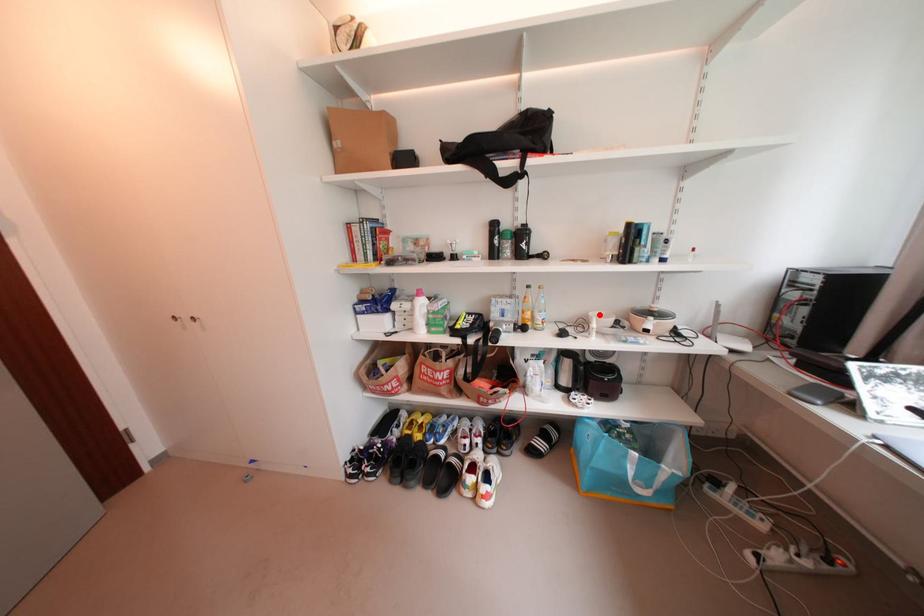
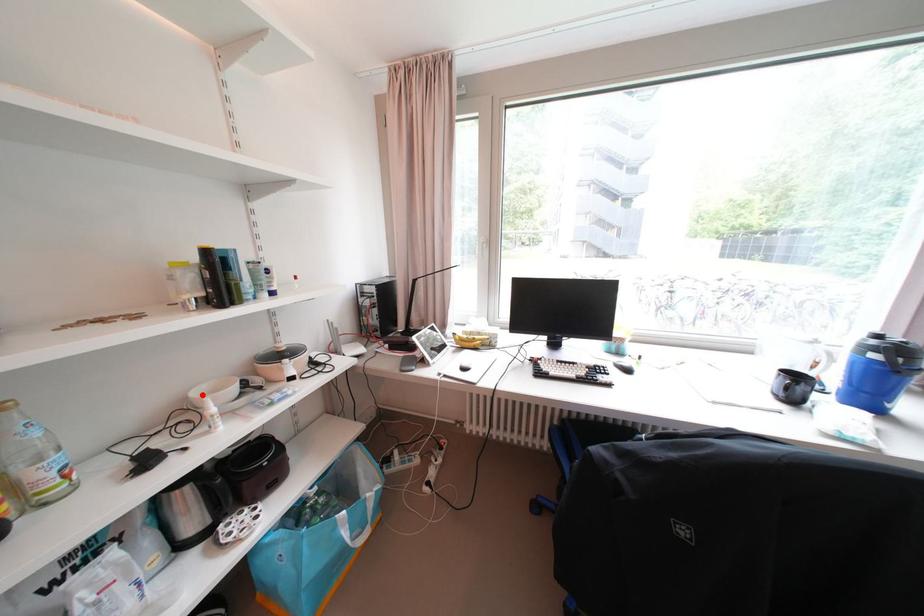
I am providing you with two images of the same scene from different viewpoints. A red point is marked on the first image and another point is marked on the second image. Do the highlighted points in image1 and image2 indicate the same real-world spot?

Yes